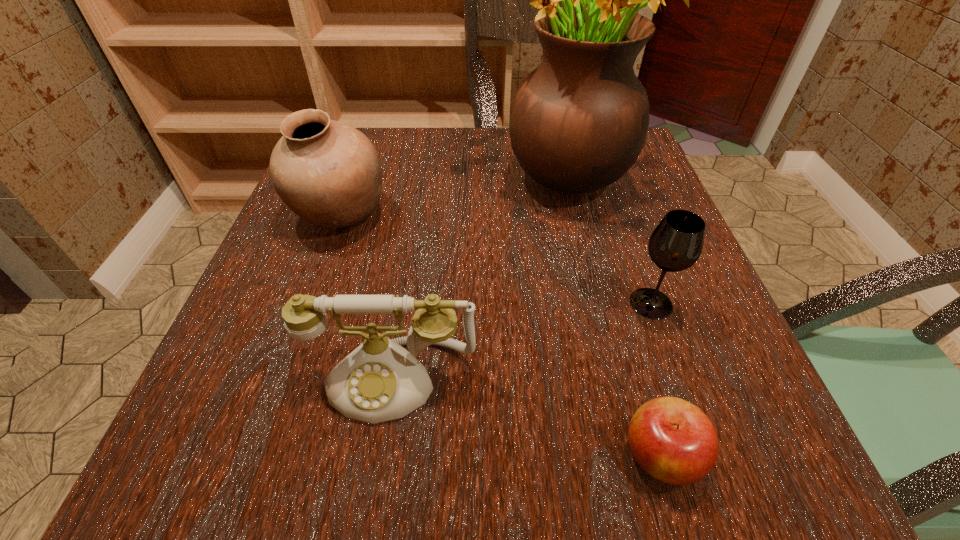
Identify the location of vacant area at the near edge of the desktop. This screenshot has width=960, height=540. (481, 495).

The image size is (960, 540). Identify the location of free space at the left edge. (283, 323).

Find the location of `vacant space at the right edge of the desktop`. vacant space at the right edge of the desktop is located at coordinates (660, 385).

In the image, there is a desktop. At what (x,y) coordinates should I click in order to perform the action: click on free space at the far left corner. Please return your answer as a coordinate pair (x, y). This screenshot has width=960, height=540. Looking at the image, I should click on (366, 136).

I want to click on free space at the near right corner, so click(743, 496).

Where is `vacant space in between the apple and the wineglass`? The image size is (960, 540). vacant space in between the apple and the wineglass is located at coordinates (656, 380).

Find the location of `free space between the shortest object and the pottery`. free space between the shortest object and the pottery is located at coordinates click(500, 335).

Locate an element on the screen. vacant point located between the tallest object and the pottery is located at coordinates (449, 194).

I want to click on empty location between the flower arrangement and the telephone, so pyautogui.click(x=475, y=275).

Where is `vacant space in between the third farthest object and the flower arrangement`? vacant space in between the third farthest object and the flower arrangement is located at coordinates (605, 238).